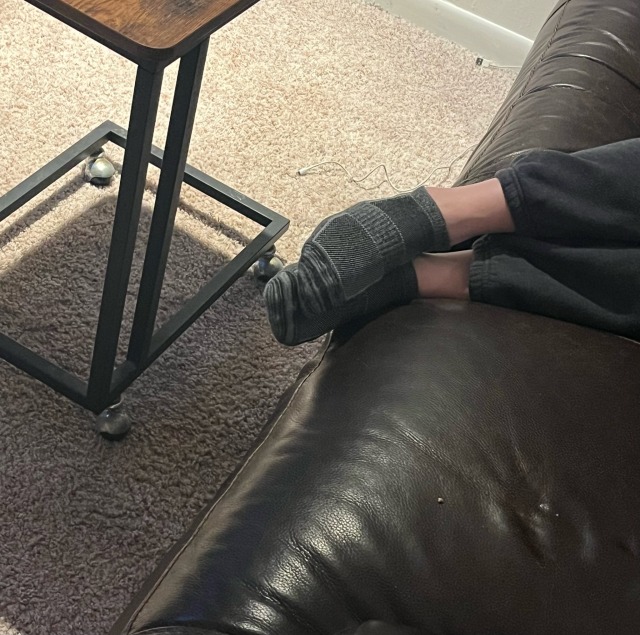
At what (x,y) coordinates should I click in order to perform the action: click on couch. Please return your answer as a coordinate pair (x, y). Looking at the image, I should click on (561, 485).